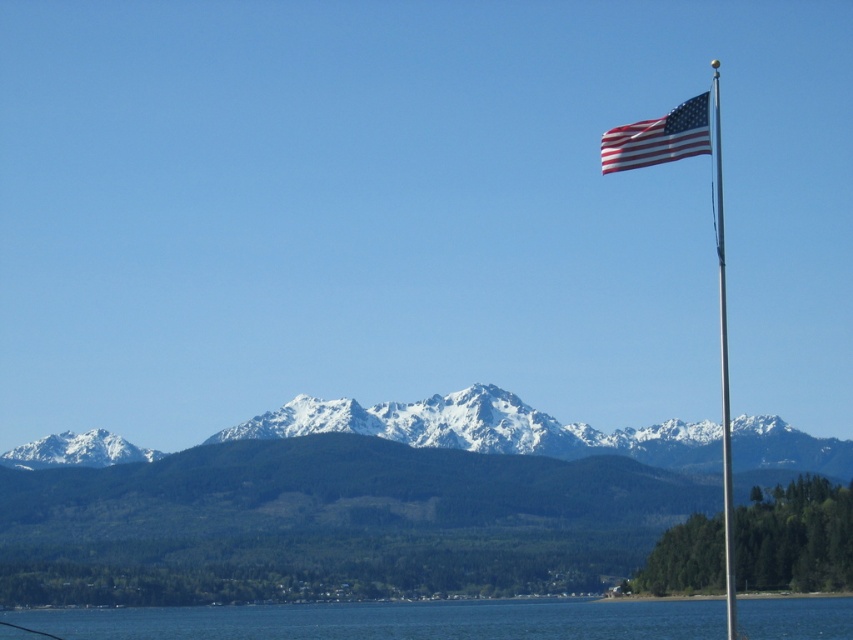
You are a photographer trying to capture the American flag at upper right in your shot. The camera is currently positioned at the center of the image. Which direction should you move the camera to get the flag into the frame?

The american flag at upper right is located at point 0.216 on the x axis and 0.773 on the y axis. Since the camera is at the center, you should move the camera to the left and upwards to align with the flag.

You are standing at the point labeled as point (393,620) in the image. What is the immediate environment around you?

The point (393,620) corresponds to blue water at lower center, so you are standing in the blue water at lower center.